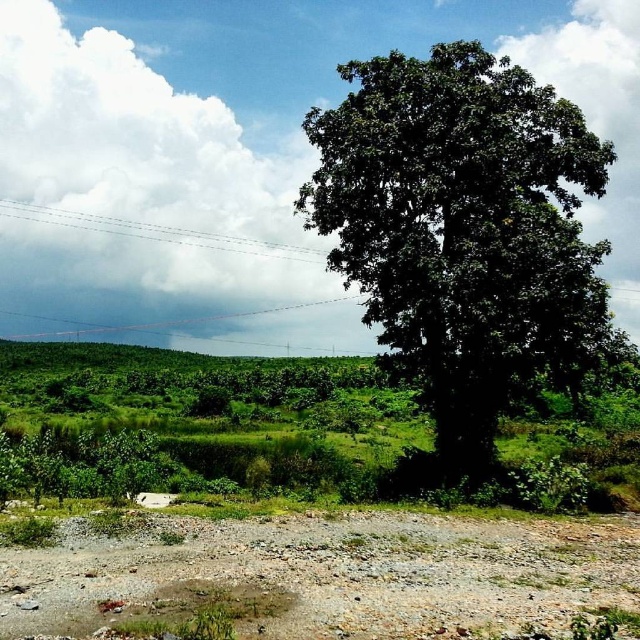
Is point (522, 378) farther from camera compared to point (588, 596)?

Yes, point (522, 378) is farther from viewer.

Which of these two, green leafy tree at right or dull brown gravel at lower center, stands shorter?

With less height is dull brown gravel at lower center.

Is point (371, 193) farther from camera compared to point (273, 520)?

That is True.

Where is `green leafy tree at right`? green leafy tree at right is located at coordinates [461, 230].